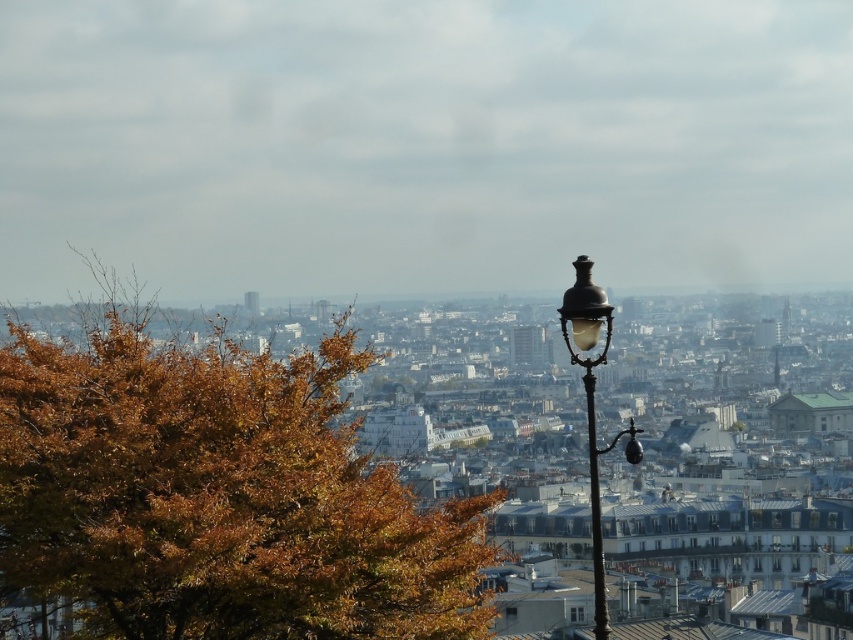
Can you confirm if brown leafy tree at left is bigger than black metal pole at right?

Correct, brown leafy tree at left is larger in size than black metal pole at right.

Is brown leafy tree at left above black metal pole at right?

Correct, brown leafy tree at left is located above black metal pole at right.

Who is more distant from viewer, [303,557] or [596,486]?

The point [596,486] is behind.

Where is `brown leafy tree at left`? brown leafy tree at left is located at coordinates (218, 493).

Can you confirm if bronze/brass street light at right is positioned to the right of black metal pole at right?

In fact, bronze/brass street light at right is to the left of black metal pole at right.

Can you confirm if bronze/brass street light at right is thinner than black metal pole at right?

No.

Where is `bronze/brass street light at right`? The width and height of the screenshot is (853, 640). bronze/brass street light at right is located at coordinates (593, 404).

The height and width of the screenshot is (640, 853). What are the coordinates of `bronze/brass street light at right` in the screenshot? It's located at (593, 404).

Is point (440, 556) in front of point (634, 440)?

No, (440, 556) is behind (634, 440).

Who is shorter, brown leafy tree at left or bronze/brass street light at right?

bronze/brass street light at right is shorter.

What do you see at coordinates (218, 493) in the screenshot? The image size is (853, 640). I see `brown leafy tree at left` at bounding box center [218, 493].

The image size is (853, 640). Identify the location of brown leafy tree at left. (218, 493).